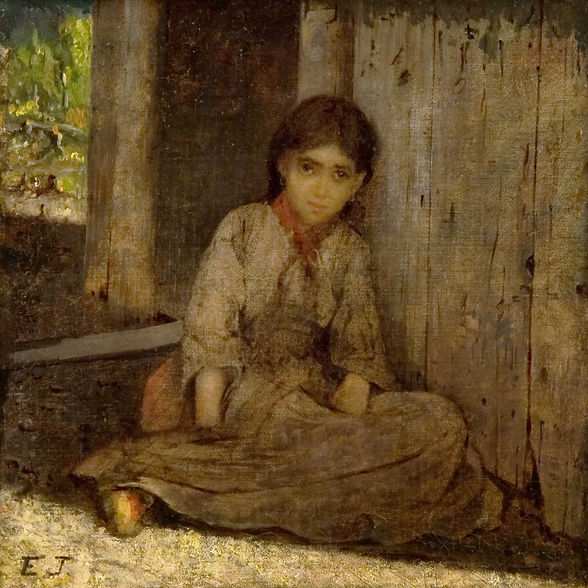
Where is `wood wall`? Image resolution: width=588 pixels, height=588 pixels. wood wall is located at coordinates (477, 213).